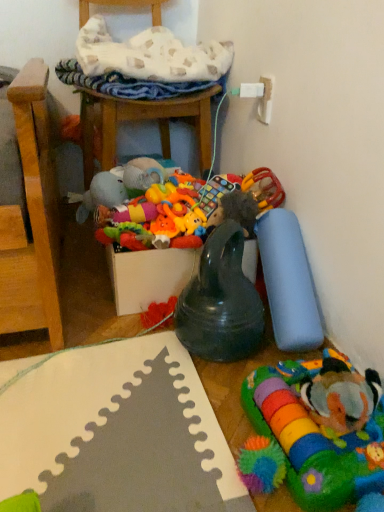
Find the location of a particular element. This screenshot has height=512, width=384. vacant space situated on the left part of rubberized black teething ring at center, the second toy from the left is located at coordinates (135, 356).